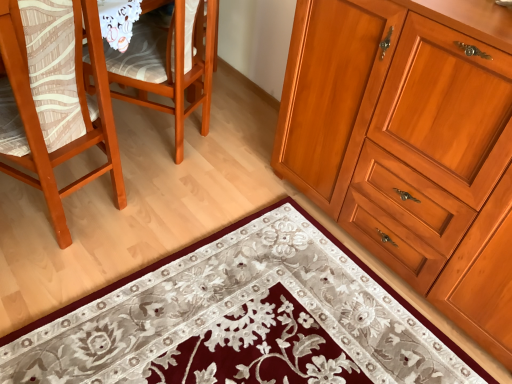
You are a GUI agent. You are given a task and a screenshot of the screen. Output one action in this format:
    pyautogui.click(x=<x>, y=<y>)
    Task: Click on the free space between wooden cabinet at right and matte wood chair at left, the second chair when ordered from right to left
    
    Given the screenshot: What is the action you would take?
    pyautogui.click(x=226, y=243)